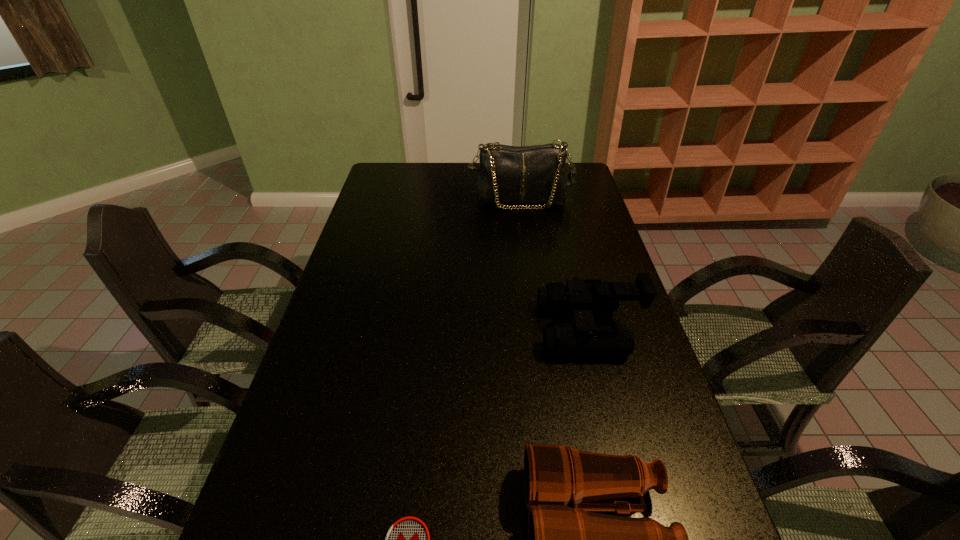
Where is `handbag`? The width and height of the screenshot is (960, 540). handbag is located at coordinates (535, 174).

Find the location of a particular element. The image size is (960, 540). the tallest object is located at coordinates (535, 174).

Find the location of a particular element. The width and height of the screenshot is (960, 540). the second farthest object is located at coordinates (580, 297).

At what (x,y) coordinates should I click in order to perform the action: click on the farther binoculars. Please return your answer as a coordinate pair (x, y). Looking at the image, I should click on (580, 297).

Locate an element on the screen. This screenshot has width=960, height=540. vacant space situated at the front of the tallest object with chain and zipper is located at coordinates (526, 247).

Where is `free region located 0.240m on the front lenses of the third nearest object`? The height and width of the screenshot is (540, 960). free region located 0.240m on the front lenses of the third nearest object is located at coordinates (454, 329).

The width and height of the screenshot is (960, 540). What are the coordinates of `blank space located 0.060m on the front lenses of the third nearest object` in the screenshot? It's located at (519, 329).

You are a GUI agent. You are given a task and a screenshot of the screen. Output one action in this format:
    pyautogui.click(x=<x>, y=<y>)
    Task: Click on the blank area located 0.210m on the front lenses of the third nearest object
    
    Given the screenshot: What is the action you would take?
    pyautogui.click(x=466, y=329)

At what (x,y) coordinates should I click in order to perform the action: click on object that is at the far edge. Please return your answer as a coordinate pair (x, y). Looking at the image, I should click on (535, 174).

The width and height of the screenshot is (960, 540). Identify the location of handbag present at the right edge. (535, 174).